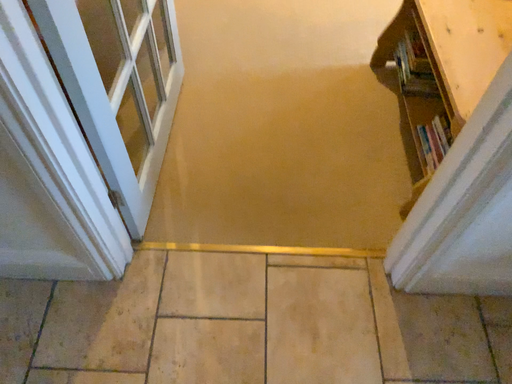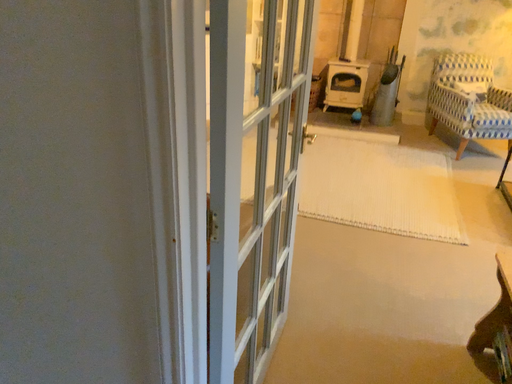
Question: Which way did the camera rotate in the video?

Choices:
 (A) rotated left
 (B) rotated right

Answer: (A)